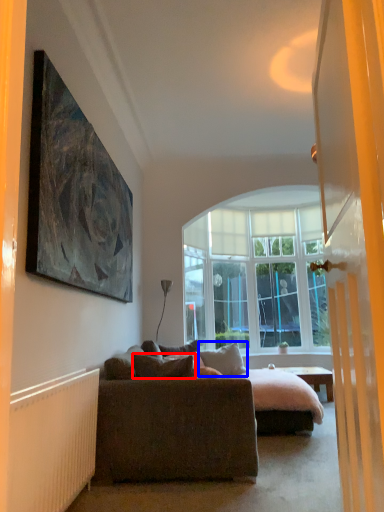
Question: Which object appears farthest to the camera in this image, pillow (highlighted by a red box) or pillow (highlighted by a blue box)?

Choices:
 (A) pillow
 (B) pillow

Answer: (B)